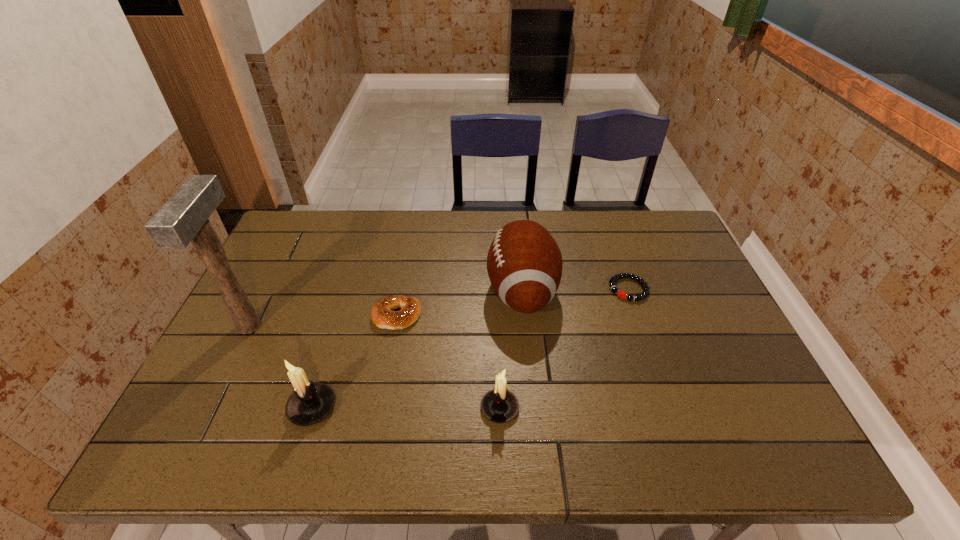
Locate an element on the screen. The image size is (960, 540). vacant space in between the football and the second shortest object is located at coordinates (459, 303).

This screenshot has height=540, width=960. Identify the location of free spot between the second tallest object and the third object from left to right. (459, 303).

Where is `free space between the third tallest object and the rightmost object`? The height and width of the screenshot is (540, 960). free space between the third tallest object and the rightmost object is located at coordinates (470, 348).

Where is `free spot between the taller candle holder and the fifth tallest object`? Image resolution: width=960 pixels, height=540 pixels. free spot between the taller candle holder and the fifth tallest object is located at coordinates (354, 361).

Select which object appears as the closest to the right candle holder. Please provide its 2D coordinates. Your answer should be formatted as a tuple, i.e. [(x, y)], where the tuple contains the x and y coordinates of a point satisfying the conditions above.

[(524, 263)]

Identify the location of the third closest object to the leftmost object. (499, 405).

The image size is (960, 540). Identify the location of blank space that satisfies the following two spatial constraints: 1. on the front side of the bracelet; 2. on the laces of the football. (629, 291).

Identify the location of vacant space that satisfies the following two spatial constraints: 1. on the back side of the mallet; 2. on the left side of the fifth tallest object. Image resolution: width=960 pixels, height=540 pixels. (254, 316).

Image resolution: width=960 pixels, height=540 pixels. Identify the location of vacant space that satisfies the following two spatial constraints: 1. on the back side of the second object from left to right; 2. on the left side of the bagel. (341, 316).

The height and width of the screenshot is (540, 960). I want to click on blank space that satisfies the following two spatial constraints: 1. on the back side of the rightmost object; 2. on the right side of the third object from left to right, so click(x=401, y=289).